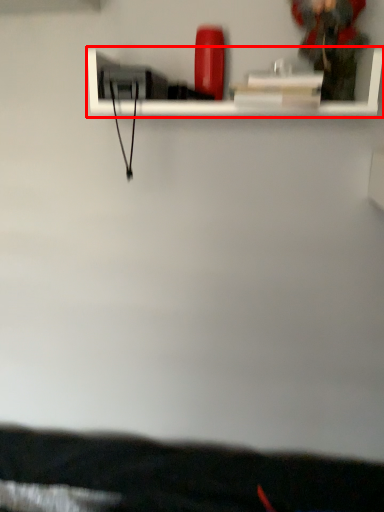
Question: From the image, what is the correct spatial relationship of shelf (annotated by the red box) in relation to person?

Choices:
 (A) right
 (B) left

Answer: (B)